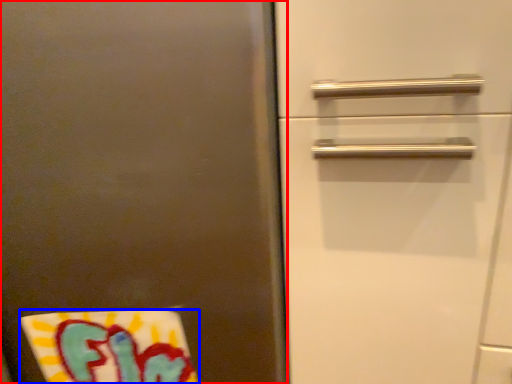
Question: Among these objects, which one is nearest to the camera, door (highlighted by a red box) or beach towel (highlighted by a blue box)?

Choices:
 (A) door
 (B) beach towel

Answer: (A)